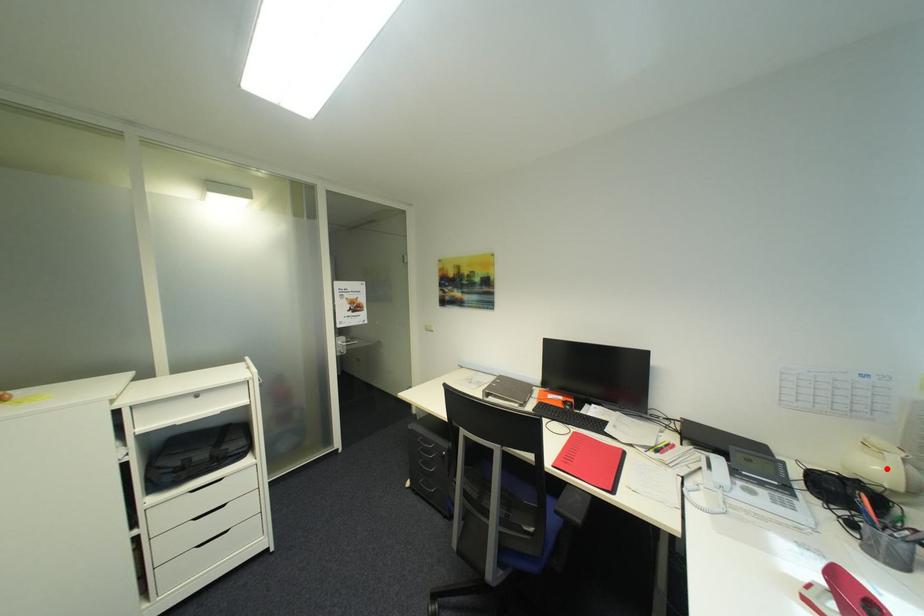
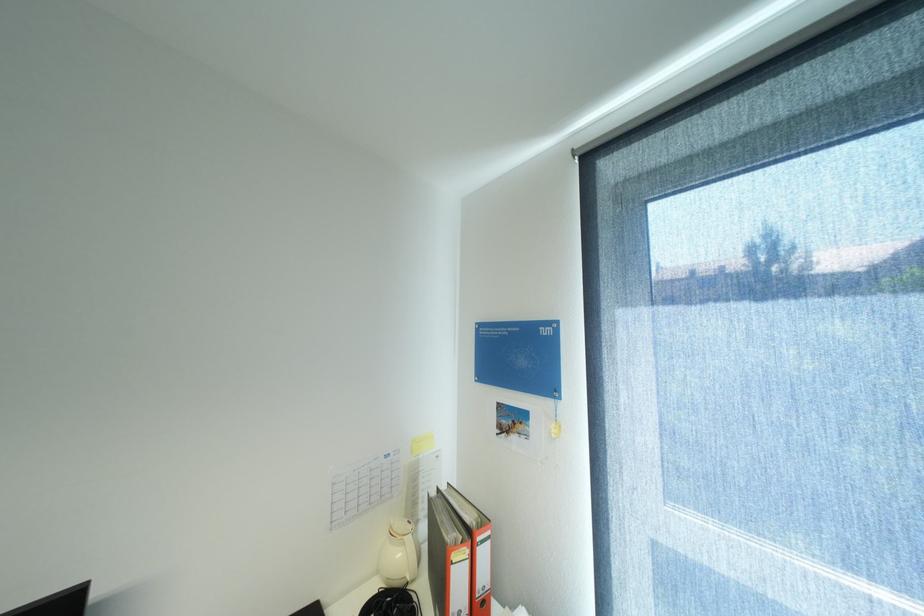
Question: I am providing you with two images of the same scene from different viewpoints. Given a red point in image1, look at the same physical point in image2. Is it:

Choices:
 (A) Closer to the viewpoint
 (B) Farther from the viewpoint

Answer: (B)